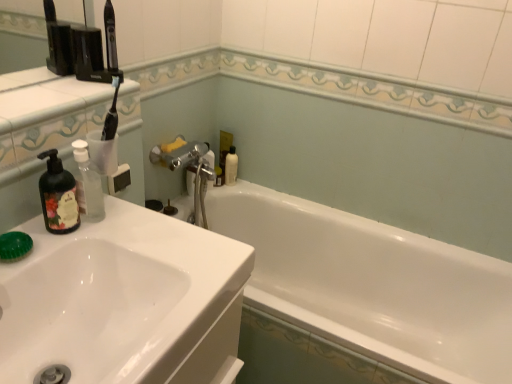
In order to click on free spot to the right of translucent plastic bottle at upper center in this screenshot , I will do `click(254, 187)`.